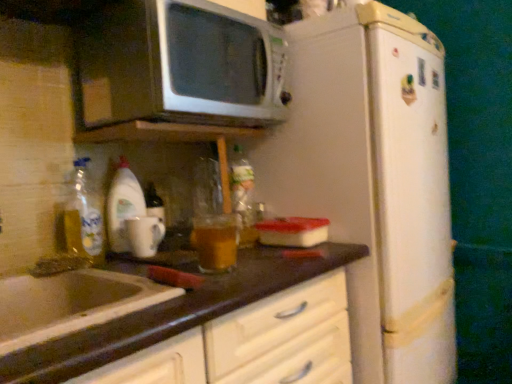
Question: Looking at the image, does white glossy mug at left seem bigger or smaller compared to translucent glass mug at left?

Choices:
 (A) big
 (B) small

Answer: (B)

Question: In terms of width, does white glossy mug at left look wider or thinner when compared to translucent glass mug at left?

Choices:
 (A) thin
 (B) wide

Answer: (A)

Question: Estimate the real-world distances between objects in this image. Which object is closer to the translucent glass mug at left?

Choices:
 (A) white glossy mug at left
 (B) white glossy sink at lower left
 (C) translucent plastic bottle at center
 (D) brown laminate countertop at lower center
 (E) white glossy microwave at upper center

Answer: (A)

Question: Which is farther from the white glossy microwave at upper center?

Choices:
 (A) translucent plastic bottle at center
 (B) white matte refrigerator at center-right
 (C) translucent glass mug at left
 (D) brown laminate countertop at lower center
 (E) white glossy sink at lower left

Answer: (E)